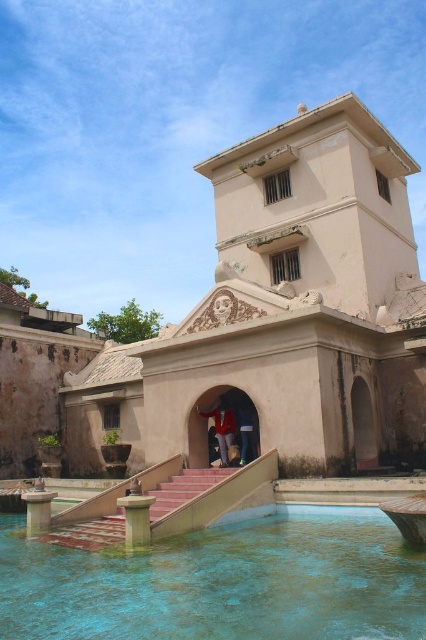
Question: Among these points, which one is farthest from the camera?

Choices:
 (A) (242, 429)
 (B) (293, 634)

Answer: (A)

Question: Can you confirm if blue glossy water at bottom is wider than dark blue jeans at center?

Choices:
 (A) yes
 (B) no

Answer: (A)

Question: Can you confirm if blue glossy water at bottom is smaller than red velvet coat at center?

Choices:
 (A) yes
 (B) no

Answer: (B)

Question: Can you confirm if blue glossy water at bottom is positioned below dark blue jeans at center?

Choices:
 (A) yes
 (B) no

Answer: (A)

Question: Among these objects, which one is farthest from the camera?

Choices:
 (A) blue glossy water at bottom
 (B) red velvet coat at center
 (C) dark blue jeans at center

Answer: (C)

Question: Which point appears closest to the camera in this image?

Choices:
 (A) (218, 435)
 (B) (336, 561)
 (C) (247, 433)

Answer: (B)